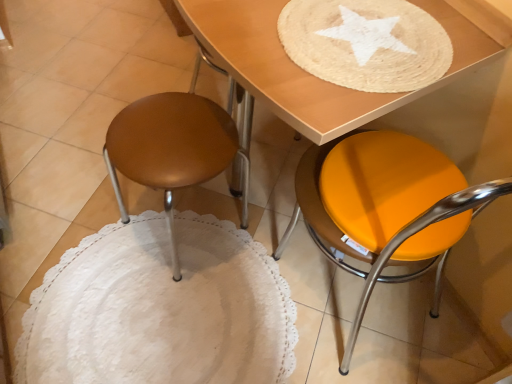
The height and width of the screenshot is (384, 512). I want to click on vacant region above matte brown stool at left (from a real-world perspective), so click(168, 135).